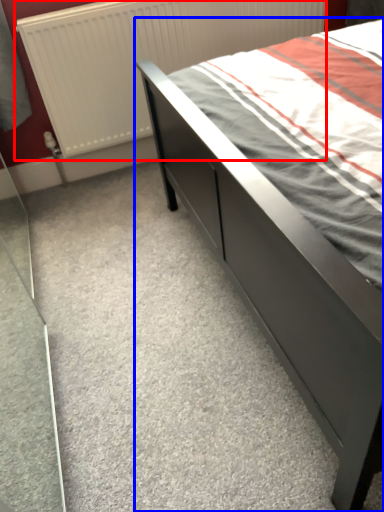
Question: Which of the following is the farthest to the observer, radiator (highlighted by a red box) or bed (highlighted by a blue box)?

Choices:
 (A) radiator
 (B) bed

Answer: (A)